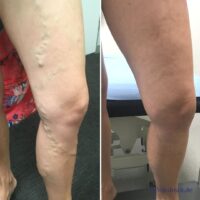
The width and height of the screenshot is (200, 200). What are the coordinates of `floor` in the screenshot? It's located at (53, 56), (82, 173), (133, 194).